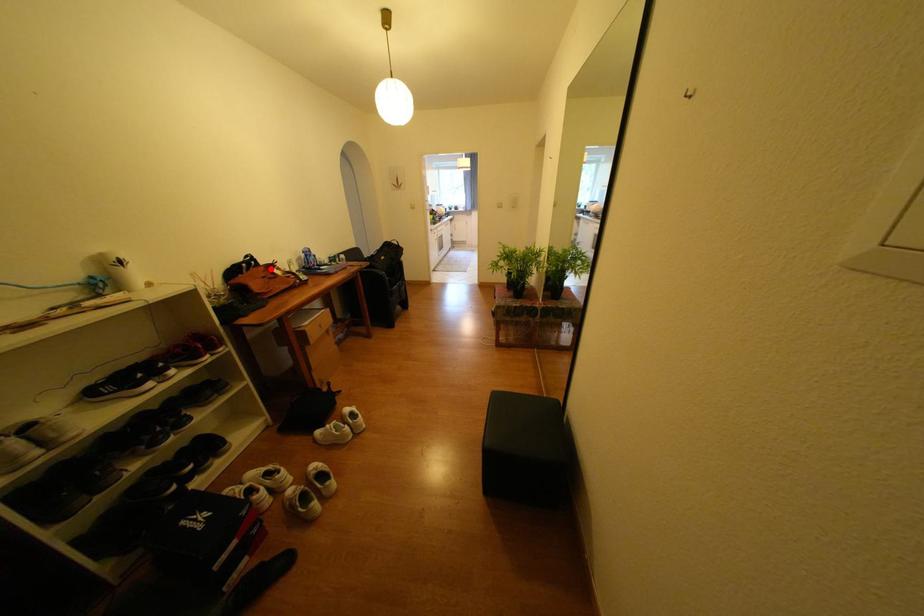
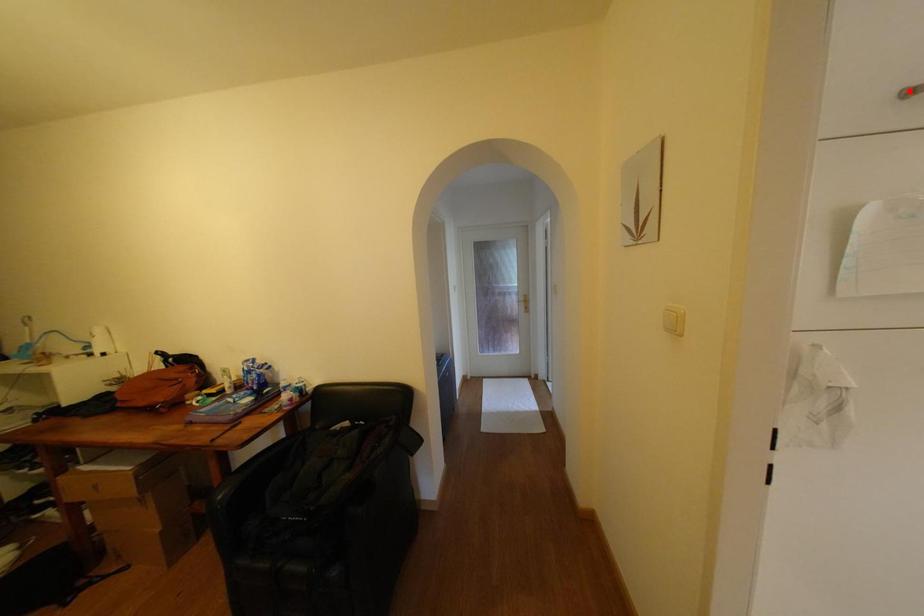
I am providing you with two images of the same scene from different viewpoints. A red point is marked on the first image and another point is marked on the second image. Does the point marked in image1 correspond to the same location as the one in image2?

No